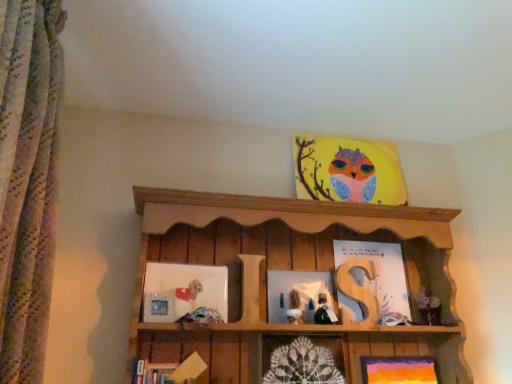
Question: Can you confirm if green glass bottle at center, the first toy viewed from the right, is positioned to the right of floral fabric curtain at left?

Choices:
 (A) yes
 (B) no

Answer: (A)

Question: Is green glass bottle at center, the first toy viewed from the right, wider than floral fabric curtain at left?

Choices:
 (A) yes
 (B) no

Answer: (B)

Question: Is green glass bottle at center, arranged as the 2th toy when viewed from the left, positioned beyond the bounds of floral fabric curtain at left?

Choices:
 (A) yes
 (B) no

Answer: (A)

Question: Would you say floral fabric curtain at left is part of green glass bottle at center, arranged as the 2th toy when viewed from the left,'s contents?

Choices:
 (A) yes
 (B) no

Answer: (B)

Question: Is green glass bottle at center, arranged as the 2th toy when viewed from the left, oriented away from floral fabric curtain at left?

Choices:
 (A) no
 (B) yes

Answer: (A)

Question: Considering the relative sizes of green glass bottle at center, arranged as the 2th toy when viewed from the left, and floral fabric curtain at left in the image provided, is green glass bottle at center, arranged as the 2th toy when viewed from the left, taller than floral fabric curtain at left?

Choices:
 (A) no
 (B) yes

Answer: (A)

Question: Considering the relative positions of matte glass picture frame at center, the 3th picture frame positioned from the bottom, and wooden shelf at upper center in the image provided, is matte glass picture frame at center, the 3th picture frame positioned from the bottom, behind wooden shelf at upper center?

Choices:
 (A) no
 (B) yes

Answer: (B)

Question: Is matte glass picture frame at center, the 3th picture frame positioned from the bottom, aimed at wooden shelf at upper center?

Choices:
 (A) yes
 (B) no

Answer: (A)

Question: Is matte glass picture frame at center, acting as the 4th picture frame starting from the top, to the right of wooden shelf at upper center from the viewer's perspective?

Choices:
 (A) yes
 (B) no

Answer: (B)

Question: From a real-world perspective, does matte glass picture frame at center, the 3th picture frame positioned from the bottom, stand above wooden shelf at upper center?

Choices:
 (A) yes
 (B) no

Answer: (B)

Question: Is matte glass picture frame at center, the 3th picture frame positioned from the bottom, thinner than wooden shelf at upper center?

Choices:
 (A) yes
 (B) no

Answer: (A)

Question: Is matte glass picture frame at center, the 3th picture frame positioned from the bottom, placed right next to wooden shelf at upper center?

Choices:
 (A) yes
 (B) no

Answer: (B)

Question: Is green glass bottle at center, arranged as the 2th toy when viewed from the left, behind matte silver picture frame at lower left, which is counted as the fourth picture frame, starting from the bottom?

Choices:
 (A) yes
 (B) no

Answer: (A)